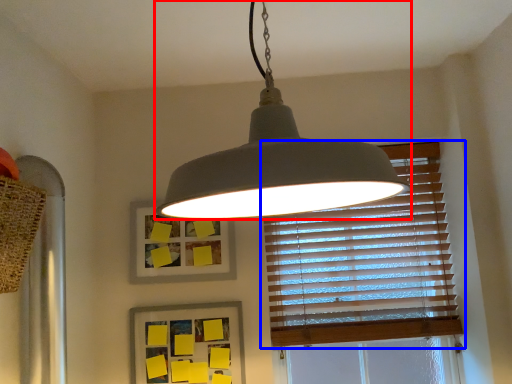
Question: Which object appears farthest to the camera in this image, lamp (highlighted by a red box) or window blind (highlighted by a blue box)?

Choices:
 (A) lamp
 (B) window blind

Answer: (B)